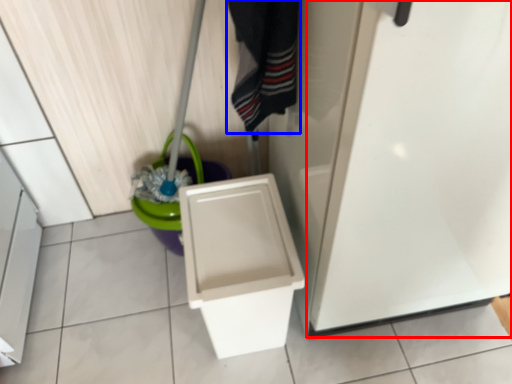
Question: Which object is further to the camera taking this photo, screen door (highlighted by a red box) or clothing (highlighted by a blue box)?

Choices:
 (A) screen door
 (B) clothing

Answer: (B)